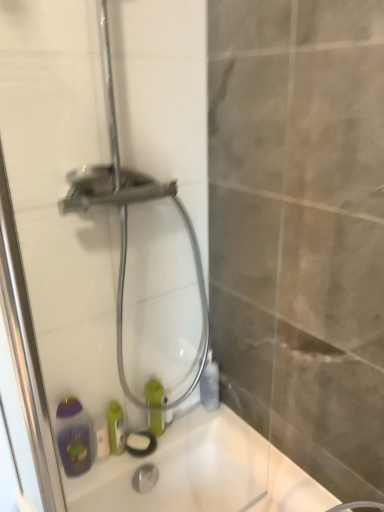
Identify the location of free area in between green matte bottle at center, placed as the 1th bottle when sorted from left to right, and matte gray bottle at right, the first bottle viewed from the right. (191, 415).